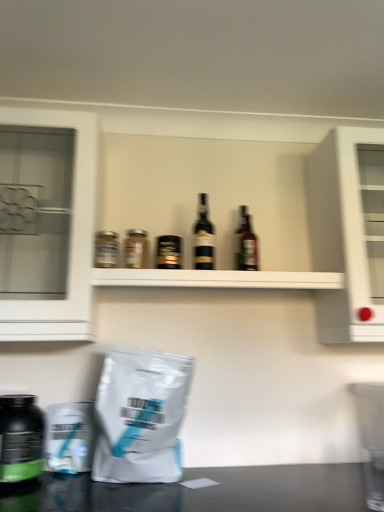
Question: From a real-world perspective, is white matte grocery bag at lower left on metallic silver jar at upper left, the fifth bottle when ordered from right to left?

Choices:
 (A) no
 (B) yes

Answer: (A)

Question: Is white matte grocery bag at lower left shorter than metallic silver jar at upper left, positioned as the second bottle in left-to-right order?

Choices:
 (A) yes
 (B) no

Answer: (B)

Question: Can you confirm if white matte grocery bag at lower left is smaller than metallic silver jar at upper left, the fifth bottle when ordered from right to left?

Choices:
 (A) no
 (B) yes

Answer: (A)

Question: Could you tell me if white matte grocery bag at lower left is turned towards metallic silver jar at upper left, positioned as the second bottle in left-to-right order?

Choices:
 (A) no
 (B) yes

Answer: (A)

Question: Is white matte grocery bag at lower left next to metallic silver jar at upper left, the fifth bottle when ordered from right to left, and touching it?

Choices:
 (A) no
 (B) yes

Answer: (A)

Question: Can you confirm if white matte grocery bag at lower left is positioned to the left of metallic silver jar at upper left, positioned as the second bottle in left-to-right order?

Choices:
 (A) yes
 (B) no

Answer: (B)

Question: From a real-world perspective, is brown glass bottle at center, which appears as the 1th bottle when viewed from the right, beneath matte glass jar at center, which is the fourth bottle in right-to-left order?

Choices:
 (A) no
 (B) yes

Answer: (A)

Question: Is brown glass bottle at center, which appears as the 1th bottle when viewed from the right, positioned far away from matte glass jar at center, which is the 3th bottle from left to right?

Choices:
 (A) yes
 (B) no

Answer: (B)

Question: Considering the relative sizes of brown glass bottle at center, which appears as the sixth bottle when viewed from the left, and matte glass jar at center, which is the 3th bottle from left to right, in the image provided, is brown glass bottle at center, which appears as the sixth bottle when viewed from the left, thinner than matte glass jar at center, which is the 3th bottle from left to right,?

Choices:
 (A) yes
 (B) no

Answer: (A)

Question: Is matte glass jar at center, which is the 3th bottle from left to right, located within brown glass bottle at center, which appears as the sixth bottle when viewed from the left?

Choices:
 (A) no
 (B) yes

Answer: (A)

Question: Is brown glass bottle at center, which appears as the 1th bottle when viewed from the right, shorter than matte glass jar at center, which is the 3th bottle from left to right?

Choices:
 (A) no
 (B) yes

Answer: (A)

Question: From a real-world perspective, does brown glass bottle at center, which appears as the 1th bottle when viewed from the right, stand above matte glass jar at center, which is the 3th bottle from left to right?

Choices:
 (A) yes
 (B) no

Answer: (A)

Question: Does white matte grocery bag at lower left have a greater width compared to white glass cabinet at left, which is counted as the 2th cabinetry, starting from the right?

Choices:
 (A) no
 (B) yes

Answer: (A)